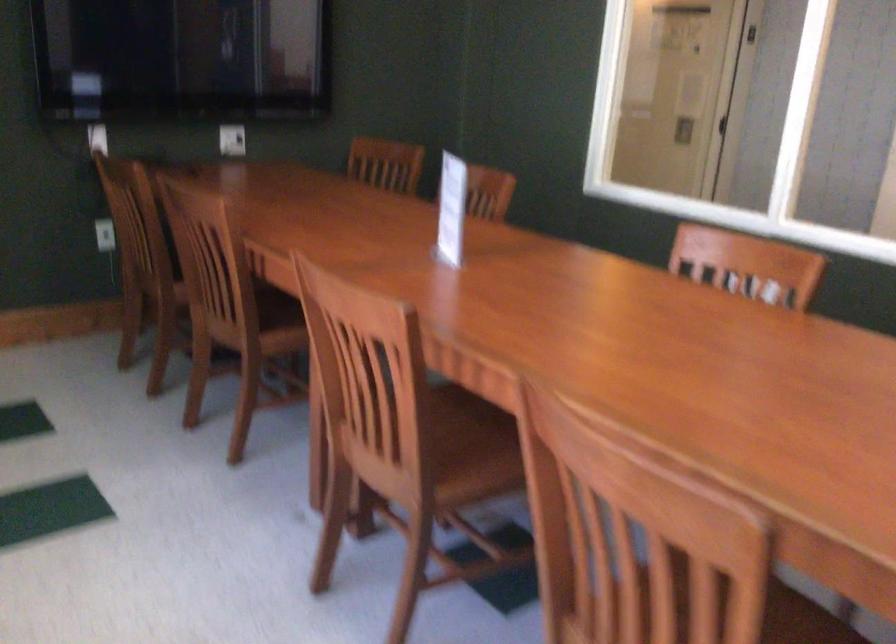
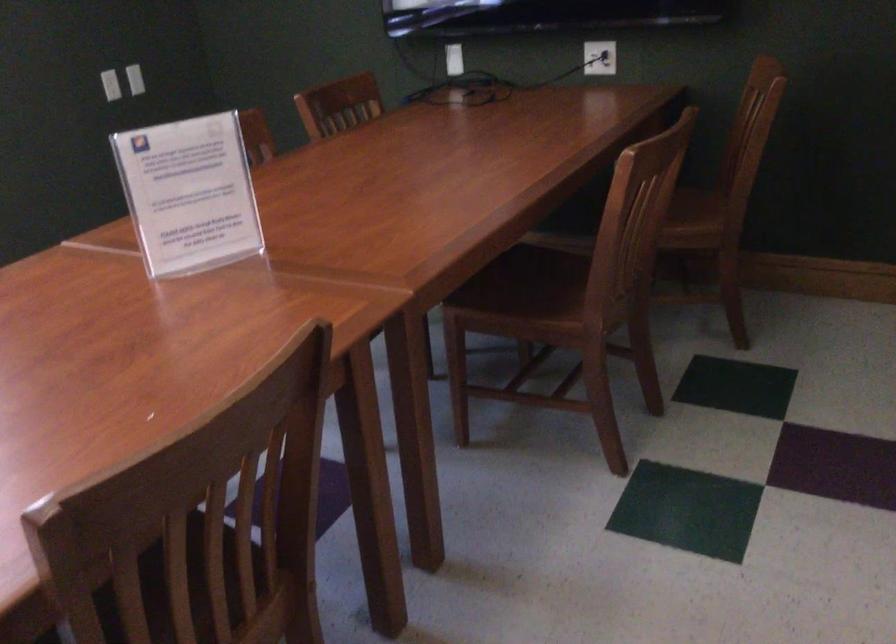
In the second image, find the point that corresponds to pixel 113 142 in the first image.

(453, 59)